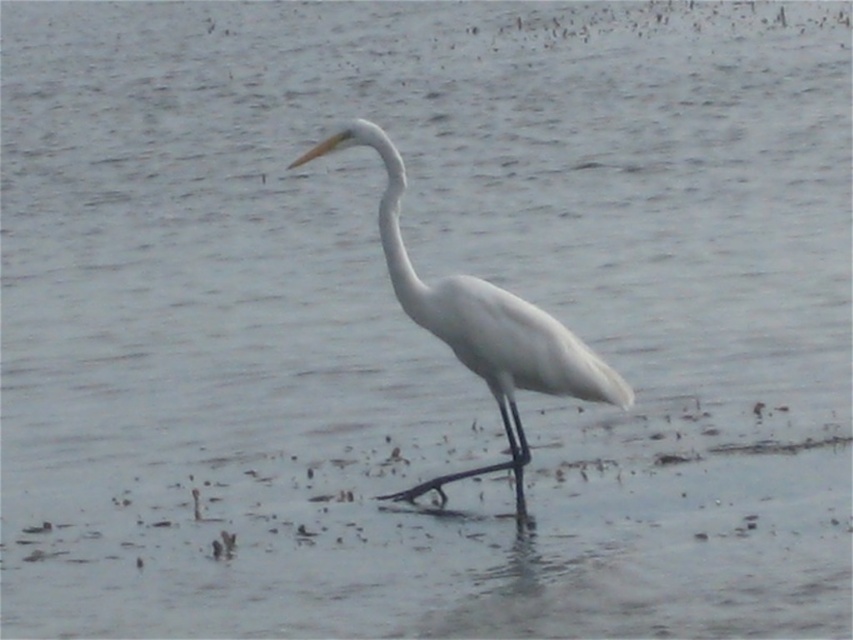
Does point (547, 381) come closer to viewer compared to point (405, 308)?

No, it is behind (405, 308).

Is white matte bird at center below white smooth neck at center?

Correct, white matte bird at center is located below white smooth neck at center.

Which is behind, point (447, 282) or point (403, 308)?

The point (403, 308) is behind.

The width and height of the screenshot is (853, 640). Identify the location of white matte bird at center. (479, 324).